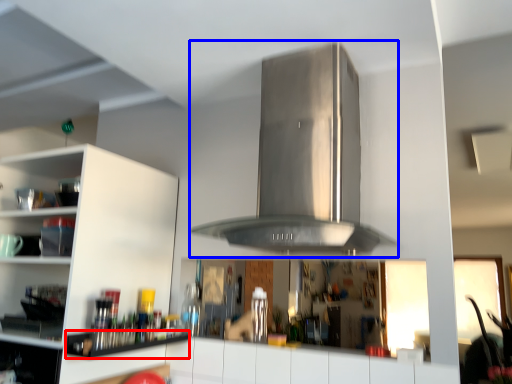
Question: Which of the following is the farthest to the observer, shelf (highlighted by a red box) or vent (highlighted by a blue box)?

Choices:
 (A) shelf
 (B) vent

Answer: (A)